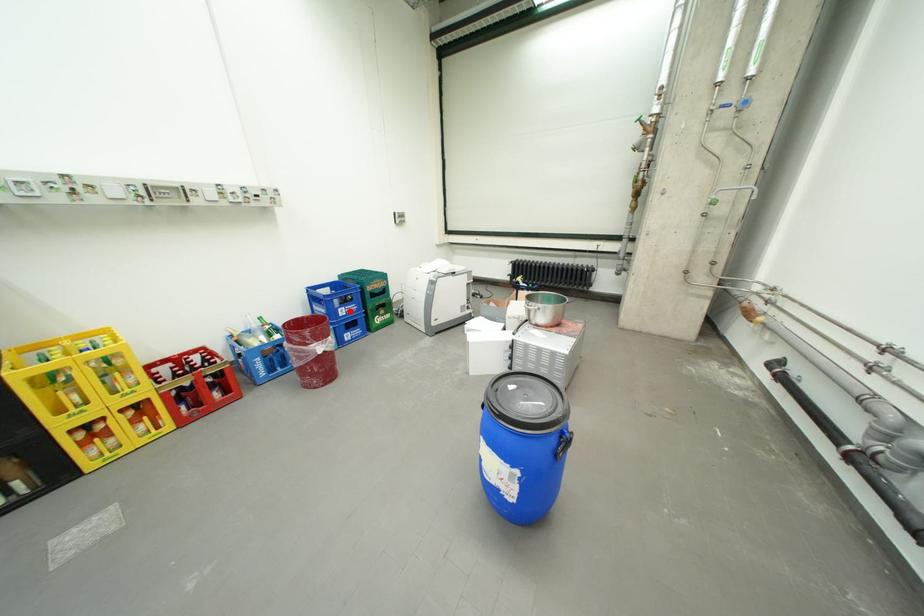
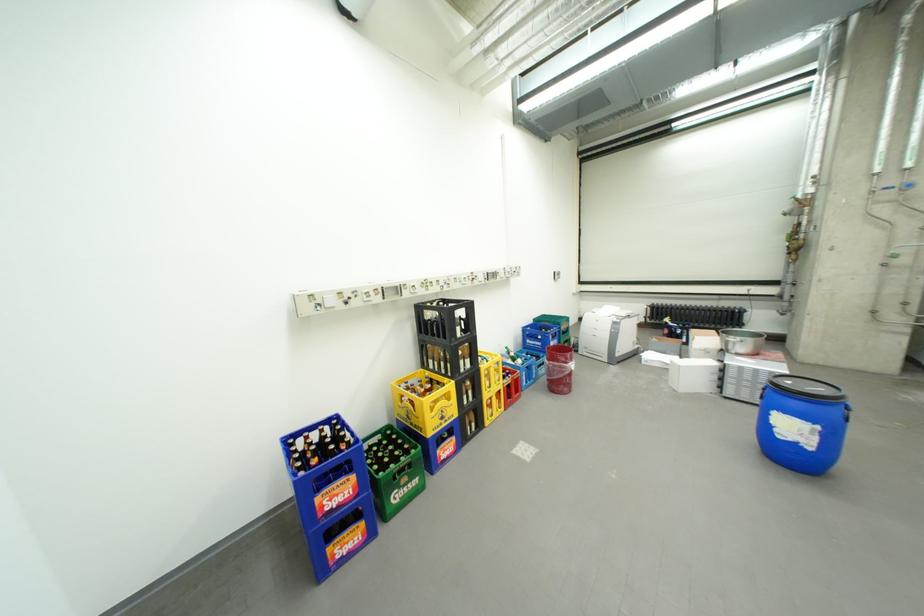
Locate, in the second image, the point that corresponds to the highlighted location in the first image.

(562, 344)